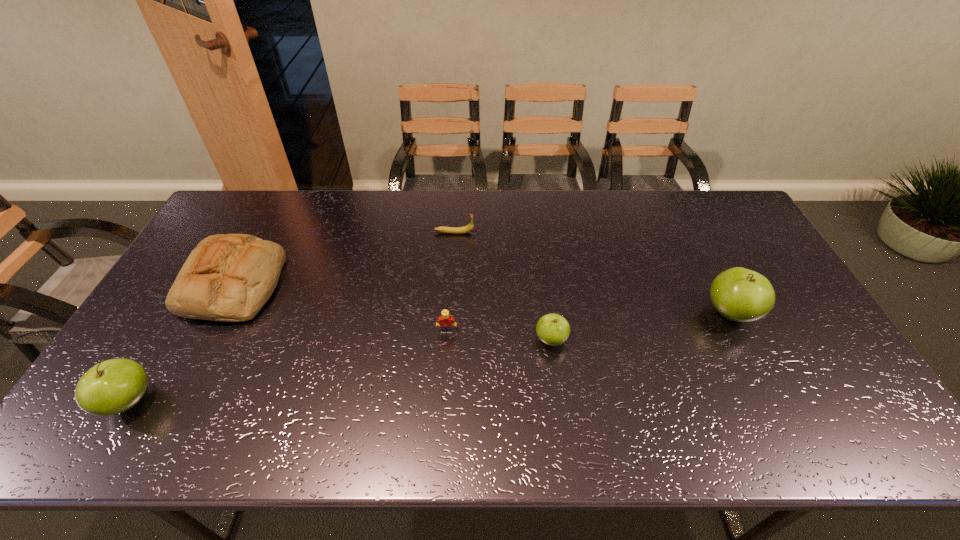
The image size is (960, 540). Find the location of `blank space at the far edge of the desktop`. blank space at the far edge of the desktop is located at coordinates (544, 214).

Image resolution: width=960 pixels, height=540 pixels. I want to click on vacant space at the near edge of the desktop, so tap(667, 401).

Locate an element on the screen. vacant area at the right edge of the desktop is located at coordinates (731, 253).

Where is `unoccupied area between the nearest apple and the Lego`? unoccupied area between the nearest apple and the Lego is located at coordinates (288, 367).

In order to click on empty location between the second object from right to left and the banana in this screenshot , I will do `click(503, 286)`.

The width and height of the screenshot is (960, 540). I want to click on unoccupied area between the Lego and the bread, so click(x=341, y=308).

Find the location of `vacant space that's between the rightmost apple and the second shortest apple`. vacant space that's between the rightmost apple and the second shortest apple is located at coordinates (429, 357).

What are the coordinates of `vacant space that is in between the fifth object from left to right and the Lego` in the screenshot? It's located at (499, 336).

Where is `empty space between the nearest apple and the Lego`? The width and height of the screenshot is (960, 540). empty space between the nearest apple and the Lego is located at coordinates (288, 367).

Where is `unoccupied position between the rightmost object and the second shortest apple`? The width and height of the screenshot is (960, 540). unoccupied position between the rightmost object and the second shortest apple is located at coordinates (429, 357).